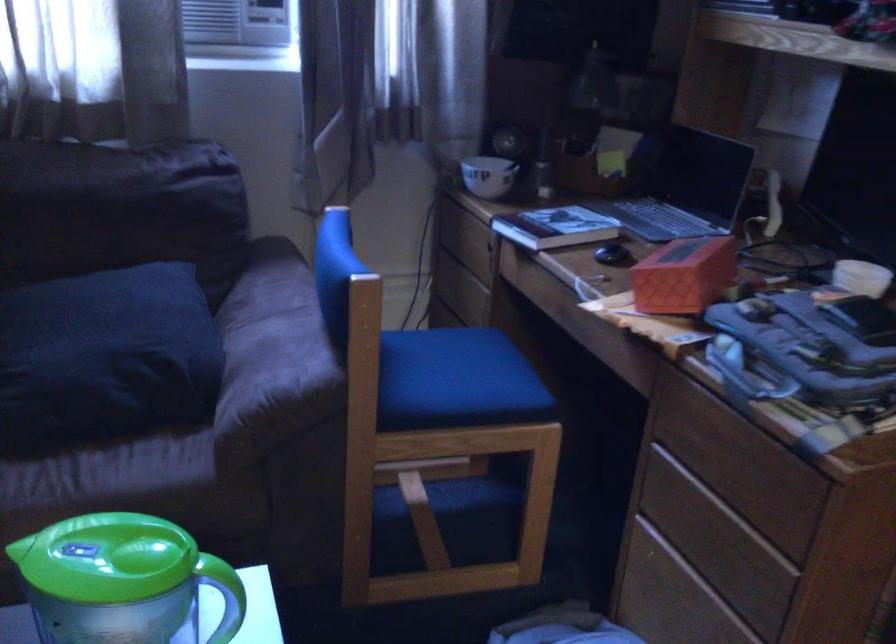
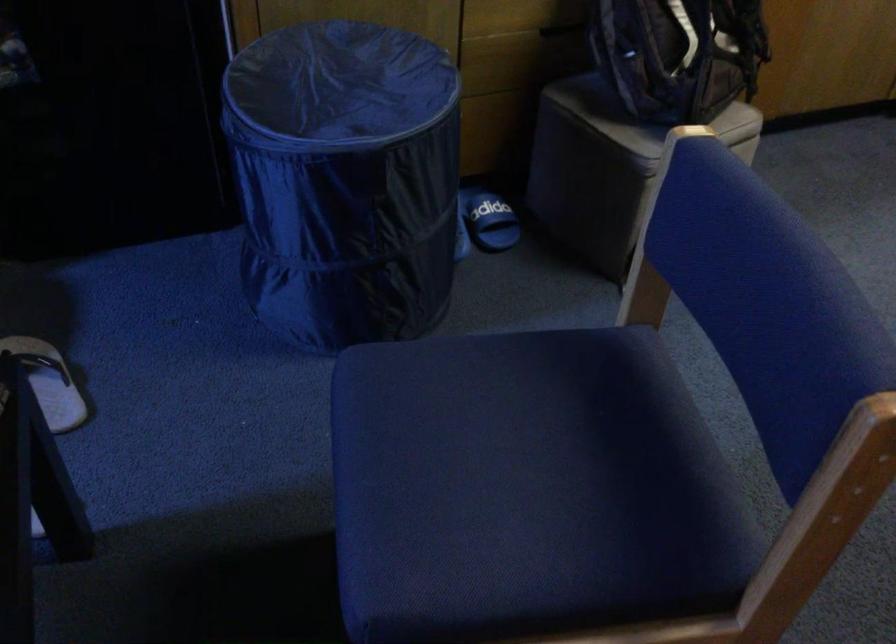
How did the camera likely rotate?

The camera's rotation is toward right-down.